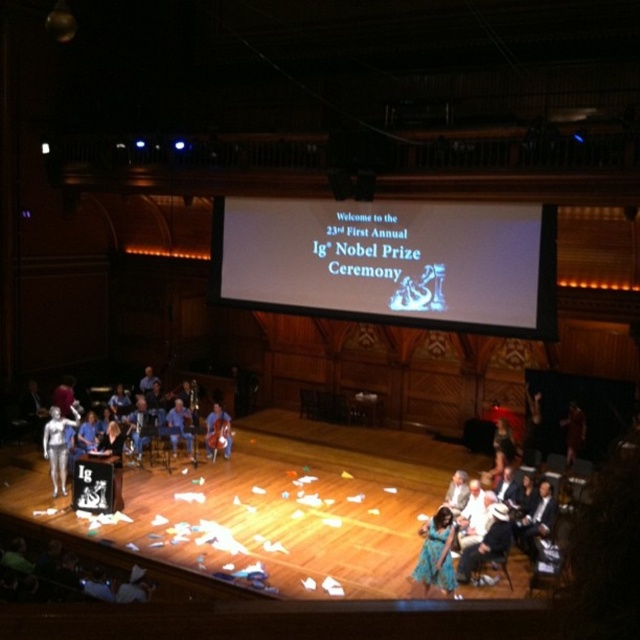
Identify the location of silver metallic statue at center. The width and height of the screenshot is (640, 640). (58, 445).

Does silver metallic figure at left appear on the right side of blue satin dress at center?

No, silver metallic figure at left is not to the right of blue satin dress at center.

The height and width of the screenshot is (640, 640). What are the coordinates of `silver metallic figure at left` in the screenshot? It's located at (93, 435).

Does silver metallic figure at left have a greater height compared to smooth brown leather jacket at right?

Correct, silver metallic figure at left is much taller as smooth brown leather jacket at right.

The image size is (640, 640). What do you see at coordinates (93, 435) in the screenshot? I see `silver metallic figure at left` at bounding box center [93, 435].

You are a GUI agent. You are given a task and a screenshot of the screen. Output one action in this format:
    pyautogui.click(x=<x>, y=<y>)
    Task: Click on the silver metallic figure at left
    The width and height of the screenshot is (640, 640).
    Given the screenshot: What is the action you would take?
    pyautogui.click(x=93, y=435)